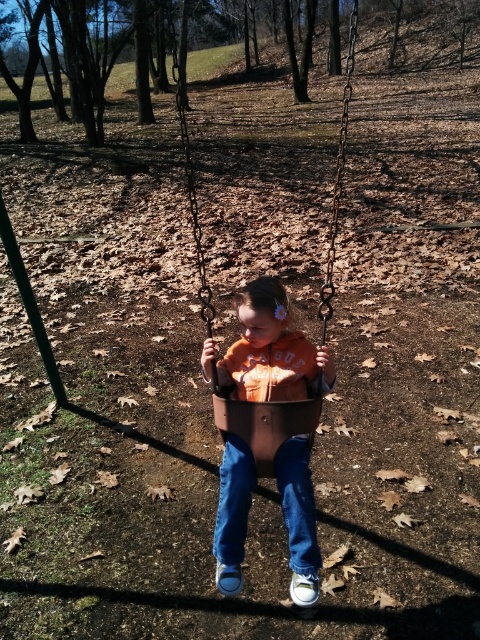
You are a photographer trying to capture a photo of the matte orange hoodie at center and the brown leather swing at center. Since you want both objects in focus, you need to know their positions relative to each other. Which object is positioned to the left?

The matte orange hoodie at center is to the left of the brown leather swing at center.

You are a parent trying to ensure your child can safely reach the swing. The child is wearing denim at center. Is the brown leather swing at center high enough for the child to comfortably reach the chains?

The brown leather swing at center has a greater height compared to denim at center. Since the swing is taller than the child wearing denim at center, the child may need assistance to reach the chains comfortably.

You are standing at the point labeled as point (272,349). What object are you directly facing in the scene?

The point labeled as point (272,349) is directly facing the matte orange hoodie at center.